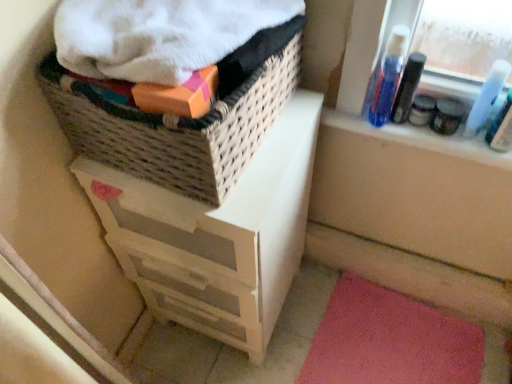
Question: Is white painted wood chest of drawers at upper left turned away from matte black jar at upper right, the 1th toiletry positioned from the left?

Choices:
 (A) yes
 (B) no

Answer: (B)

Question: From the image's perspective, would you say white painted wood chest of drawers at upper left is positioned over matte black jar at upper right, positioned as the second toiletry in right-to-left order?

Choices:
 (A) no
 (B) yes

Answer: (A)

Question: Is white painted wood chest of drawers at upper left aimed at matte black jar at upper right, the 1th toiletry positioned from the left?

Choices:
 (A) no
 (B) yes

Answer: (A)

Question: From a real-world perspective, is white painted wood chest of drawers at upper left below matte black jar at upper right, the 1th toiletry positioned from the left?

Choices:
 (A) no
 (B) yes

Answer: (B)

Question: Would you say white painted wood chest of drawers at upper left is a long distance from matte black jar at upper right, the 1th toiletry positioned from the left?

Choices:
 (A) no
 (B) yes

Answer: (A)

Question: Is the depth of white painted wood chest of drawers at upper left less than that of matte black jar at upper right, the 1th toiletry positioned from the left?

Choices:
 (A) no
 (B) yes

Answer: (B)

Question: Is white painted wood chest of drawers at upper left smaller than blue plastic bottle at upper right, the 2th mouthwash viewed from the right?

Choices:
 (A) no
 (B) yes

Answer: (A)

Question: Is white painted wood chest of drawers at upper left positioned far away from blue plastic bottle at upper right, the 2th mouthwash viewed from the right?

Choices:
 (A) yes
 (B) no

Answer: (B)

Question: Can you confirm if white painted wood chest of drawers at upper left is thinner than blue plastic bottle at upper right, the second mouthwash from the left?

Choices:
 (A) yes
 (B) no

Answer: (B)

Question: Considering the relative sizes of white painted wood chest of drawers at upper left and blue plastic bottle at upper right, the 2th mouthwash viewed from the right, in the image provided, is white painted wood chest of drawers at upper left taller than blue plastic bottle at upper right, the 2th mouthwash viewed from the right,?

Choices:
 (A) no
 (B) yes

Answer: (B)

Question: From a real-world perspective, does white painted wood chest of drawers at upper left sit lower than blue plastic bottle at upper right, the 2th mouthwash viewed from the right?

Choices:
 (A) no
 (B) yes

Answer: (B)

Question: Can you confirm if white painted wood chest of drawers at upper left is bigger than blue plastic bottle at upper right, the 2th mouthwash viewed from the right?

Choices:
 (A) no
 (B) yes

Answer: (B)

Question: Can you confirm if white painted wood chest of drawers at upper left is wider than blue plastic bottle at upper right, acting as the 3th mouthwash starting from the right?

Choices:
 (A) no
 (B) yes

Answer: (B)